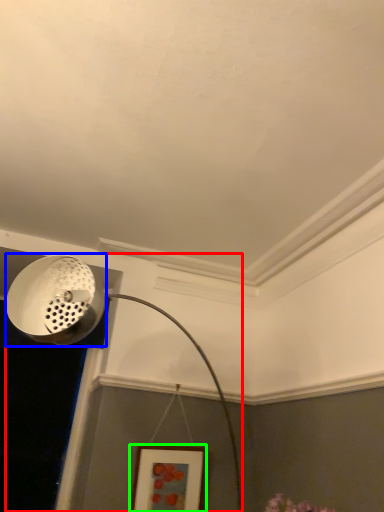
Question: Which object is the farthest from lamp (highlighted by a red box)? Choose among these: light fixture (highlighted by a blue box) or picture frame (highlighted by a green box).

Choices:
 (A) light fixture
 (B) picture frame

Answer: (B)